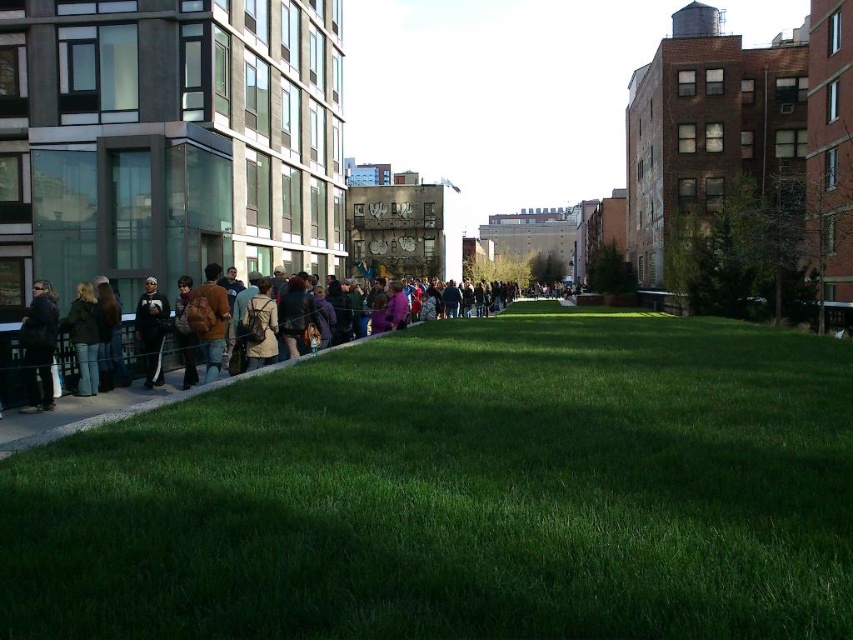
Question: Which object is the farthest from the dark blue jacket at left?

Choices:
 (A) brown fuzzy jacket at center
 (B) green grassy at center
 (C) denim jacket at left

Answer: (B)

Question: Is dark brown leather jacket at left to the left of dark blue jacket at left from the viewer's perspective?

Choices:
 (A) no
 (B) yes

Answer: (A)

Question: Which object is farther from the camera taking this photo?

Choices:
 (A) denim jacket at left
 (B) brown fuzzy jacket at center
 (C) dark blue jacket at left
 (D) dark brown leather jacket at left

Answer: (B)

Question: Where is green grassy at center located in relation to denim jacket at left in the image?

Choices:
 (A) above
 (B) below

Answer: (B)

Question: Which object is the farthest from the brown fuzzy jacket at center?

Choices:
 (A) green grassy at center
 (B) dark brown leather jacket at left

Answer: (A)

Question: Does green grassy at center have a lesser width compared to dark brown leather jacket at left?

Choices:
 (A) no
 (B) yes

Answer: (A)